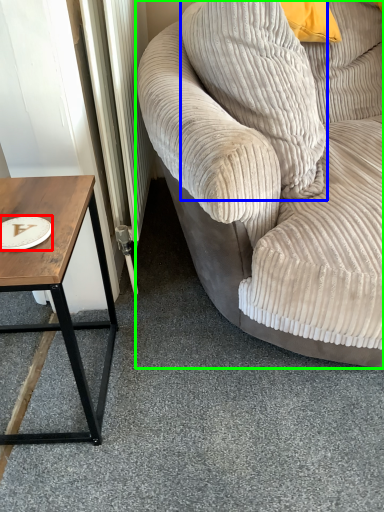
Question: Which object is positioned closest to paper plate (highlighted by a red box)? Select from pillow (highlighted by a blue box) and studio couch (highlighted by a green box).

Choices:
 (A) pillow
 (B) studio couch

Answer: (A)